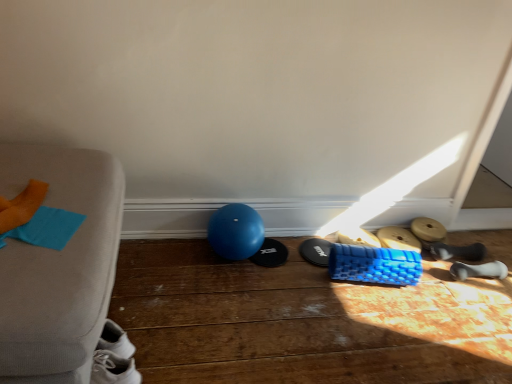
Where is `free spot in front of blue rubber ball at center`? The height and width of the screenshot is (384, 512). free spot in front of blue rubber ball at center is located at coordinates (228, 293).